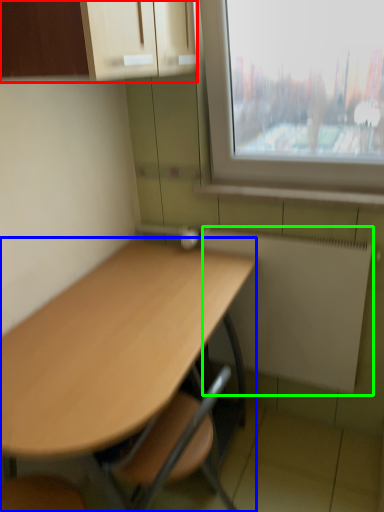
Question: Considering the real-world distances, which object is farthest from cabinetry (highlighted by a red box)? desk (highlighted by a blue box) or radiator (highlighted by a green box)?

Choices:
 (A) desk
 (B) radiator

Answer: (B)